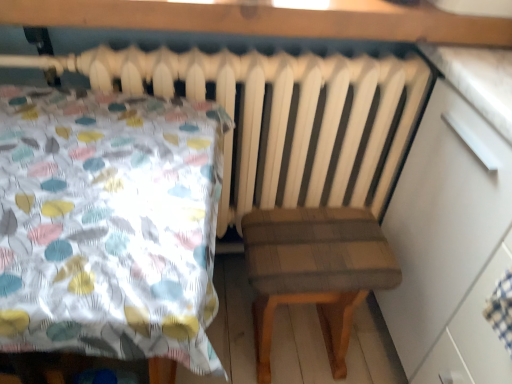
Describe the element at coordinates (314, 271) in the screenshot. I see `plaid fabric stool at center` at that location.

You are a GUI agent. You are given a task and a screenshot of the screen. Output one action in this format:
    pyautogui.click(x=<x>, y=<y>)
    Task: Click on the plaid fabric stool at center
    
    Given the screenshot: What is the action you would take?
    pyautogui.click(x=314, y=271)

The height and width of the screenshot is (384, 512). What do you see at coordinates (449, 247) in the screenshot?
I see `white glossy dresser at right` at bounding box center [449, 247].

The width and height of the screenshot is (512, 384). I want to click on white glossy dresser at right, so click(x=449, y=247).

What is the approximate width of white glossy dresser at right?

It is 23.22 inches.

At what (x,y) coordinates should I click in order to perform the action: click on plaid fabric stool at center. Please return your answer as a coordinate pair (x, y). This screenshot has width=512, height=384. Looking at the image, I should click on (314, 271).

Is white glossy dresser at right to the left of plaid fabric stool at center from the viewer's perspective?

Incorrect, white glossy dresser at right is not on the left side of plaid fabric stool at center.

From the picture: Is the depth of white glossy dresser at right greater than that of plaid fabric stool at center?

No, white glossy dresser at right is in front of plaid fabric stool at center.

Which is closer to the camera, [499,345] or [269,244]?

The point [499,345] is closer to the camera.

From the image's perspective, between white glossy dresser at right and plaid fabric stool at center, who is located below?

plaid fabric stool at center appears lower in the image.

From a real-world perspective, is white glossy dresser at right physically below plaid fabric stool at center?

Incorrect, from a real-world perspective, white glossy dresser at right is higher than plaid fabric stool at center.

Does white glossy dresser at right have a lesser width compared to plaid fabric stool at center?

Incorrect, the width of white glossy dresser at right is not less than that of plaid fabric stool at center.

Who is taller, white glossy dresser at right or plaid fabric stool at center?

white glossy dresser at right.

Between white glossy dresser at right and plaid fabric stool at center, which one has smaller size?

plaid fabric stool at center is smaller.

Could plaid fabric stool at center be considered to be inside white glossy dresser at right?

That's incorrect, plaid fabric stool at center is not inside white glossy dresser at right.

Is white glossy dresser at right touching plaid fabric stool at center?

They are not placed beside each other.

Is white glossy dresser at right looking in the opposite direction of plaid fabric stool at center?

No, white glossy dresser at right is not facing away from plaid fabric stool at center.

Where is `stool below the white glossy dresser at right (from a real-world perspective)`? The image size is (512, 384). stool below the white glossy dresser at right (from a real-world perspective) is located at coordinates (314, 271).

Visually, is plaid fabric stool at center positioned to the left or to the right of white glossy dresser at right?

plaid fabric stool at center is to the left of white glossy dresser at right.

Considering their positions, is plaid fabric stool at center located in front of or behind white glossy dresser at right?

Clearly, plaid fabric stool at center is behind white glossy dresser at right.

Considering the points (283, 258) and (490, 273), which point is behind, point (283, 258) or point (490, 273)?

The point (283, 258) is behind.

From the image's perspective, which one is positioned lower, plaid fabric stool at center or white glossy dresser at right?

plaid fabric stool at center is shown below in the image.

From a real-world perspective, which is physically above, plaid fabric stool at center or white glossy dresser at right?

From a 3D spatial view, white glossy dresser at right is above.

Considering the sizes of plaid fabric stool at center and white glossy dresser at right in the image, is plaid fabric stool at center wider or thinner than white glossy dresser at right?

Considering their sizes, plaid fabric stool at center looks slimmer than white glossy dresser at right.

Is plaid fabric stool at center taller than white glossy dresser at right?

Incorrect, the height of plaid fabric stool at center is not larger of that of white glossy dresser at right.

Is plaid fabric stool at center smaller than white glossy dresser at right?

Correct, plaid fabric stool at center occupies less space than white glossy dresser at right.

Is plaid fabric stool at center situated inside white glossy dresser at right or outside?

plaid fabric stool at center is not inside white glossy dresser at right, it's outside.

Is plaid fabric stool at center next to white glossy dresser at right?

No.

Is plaid fabric stool at center aimed at white glossy dresser at right?

No, plaid fabric stool at center is not oriented towards white glossy dresser at right.

How different are the orientations of plaid fabric stool at center and white glossy dresser at right in degrees?

88.9 degrees.

Find the location of a particular element. dresser that is above the plaid fabric stool at center (from the image's perspective) is located at coordinates (449, 247).

You are a GUI agent. You are given a task and a screenshot of the screen. Output one action in this format:
    pyautogui.click(x=<x>, y=<y>)
    Task: Click on the dresser that is in front of the plaid fabric stool at center
    The width and height of the screenshot is (512, 384).
    Given the screenshot: What is the action you would take?
    pyautogui.click(x=449, y=247)

This screenshot has height=384, width=512. I want to click on dresser above the plaid fabric stool at center (from the image's perspective), so click(x=449, y=247).